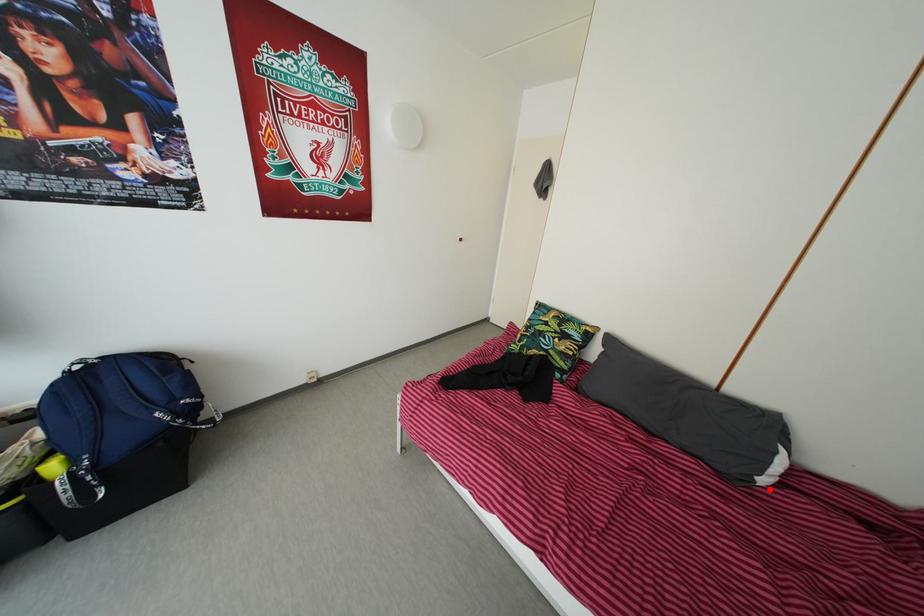
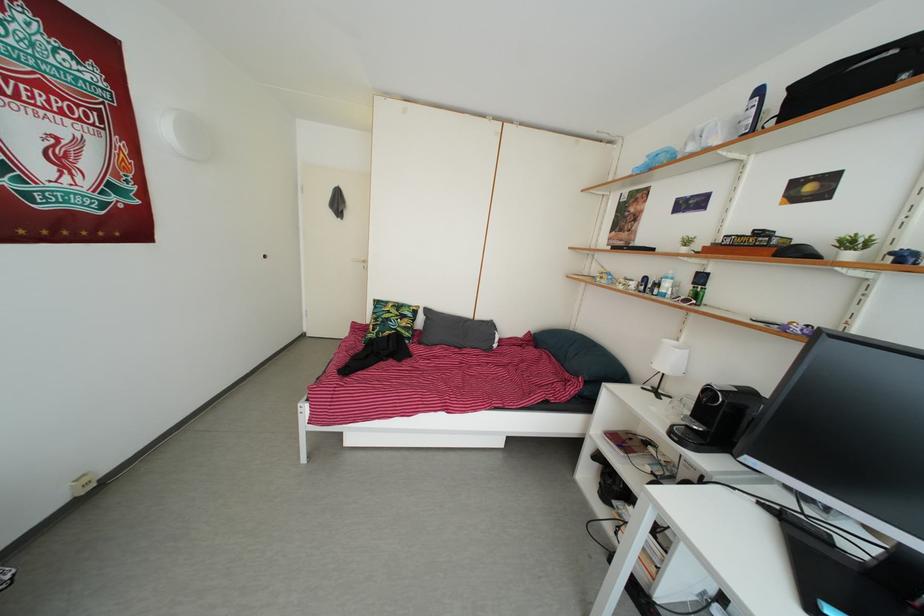
The point at the highlighted location is marked in the first image. Where is the corresponding point in the second image?

(502, 354)